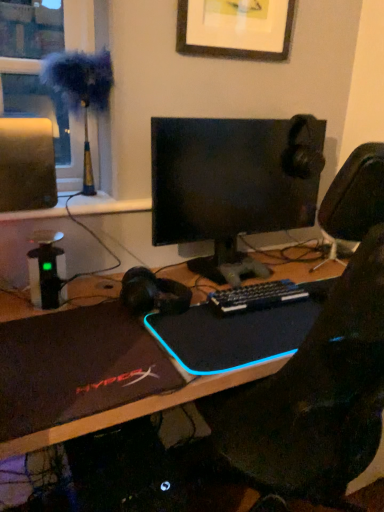
This screenshot has width=384, height=512. What are the coordinates of `vacant space that is to the left of black plastic keyboard at center` in the screenshot? It's located at (193, 301).